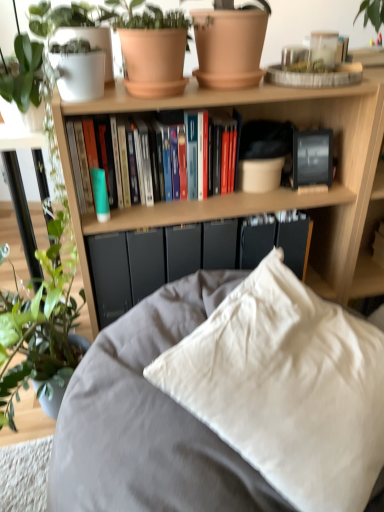
Question: Is white cotton pillow at center oriented towards wooden bookcase at upper center?

Choices:
 (A) no
 (B) yes

Answer: (A)

Question: Is white cotton pillow at center not close to wooden bookcase at upper center?

Choices:
 (A) no
 (B) yes

Answer: (A)

Question: Can you confirm if white cotton pillow at center is taller than wooden bookcase at upper center?

Choices:
 (A) no
 (B) yes

Answer: (A)

Question: Is white cotton pillow at center at the right side of wooden bookcase at upper center?

Choices:
 (A) no
 (B) yes

Answer: (A)

Question: Considering the relative positions of white cotton pillow at center and wooden bookcase at upper center in the image provided, is white cotton pillow at center in front of wooden bookcase at upper center?

Choices:
 (A) yes
 (B) no

Answer: (A)

Question: Considering the positions of terracotta clay pot at upper center, the 1th flowerpot positioned from the left, and matte black paperback book at center, acting as the second paperback book starting from the left, in the image, is terracotta clay pot at upper center, the 1th flowerpot positioned from the left, bigger or smaller than matte black paperback book at center, acting as the second paperback book starting from the left,?

Choices:
 (A) small
 (B) big

Answer: (B)

Question: From the image's perspective, is terracotta clay pot at upper center, the 1th flowerpot positioned from the left, above or below matte black paperback book at center, the 1th paperback book viewed from the right?

Choices:
 (A) below
 (B) above

Answer: (B)

Question: Relative to matte black paperback book at center, the 1th paperback book viewed from the right, is terracotta clay pot at upper center, the 2th flowerpot viewed from the right, in front or behind?

Choices:
 (A) behind
 (B) front

Answer: (B)

Question: In the image, is terracotta clay pot at upper center, the 1th flowerpot positioned from the left, on the left side or the right side of matte black paperback book at center, the 1th paperback book viewed from the right?

Choices:
 (A) left
 (B) right

Answer: (A)

Question: Would you say matte black paperback book at center, the 1th paperback book viewed from the right, is inside or outside green glossy plant at left?

Choices:
 (A) outside
 (B) inside

Answer: (A)

Question: From a real-world perspective, relative to green glossy plant at left, is matte black paperback book at center, acting as the second paperback book starting from the left, vertically above or below?

Choices:
 (A) below
 (B) above

Answer: (A)

Question: Does point (304, 238) appear closer or farther from the camera than point (39, 109)?

Choices:
 (A) farther
 (B) closer

Answer: (A)

Question: Would you say matte black paperback book at center, the 1th paperback book viewed from the right, is to the left or to the right of green glossy plant at left in the picture?

Choices:
 (A) left
 (B) right

Answer: (B)

Question: From the image's perspective, is wooden bookcase at upper center above or below terracotta clay pot at upper center, the 2th flowerpot viewed from the right?

Choices:
 (A) below
 (B) above

Answer: (A)

Question: From a real-world perspective, is wooden bookcase at upper center physically located above or below terracotta clay pot at upper center, the 2th flowerpot viewed from the right?

Choices:
 (A) above
 (B) below

Answer: (B)